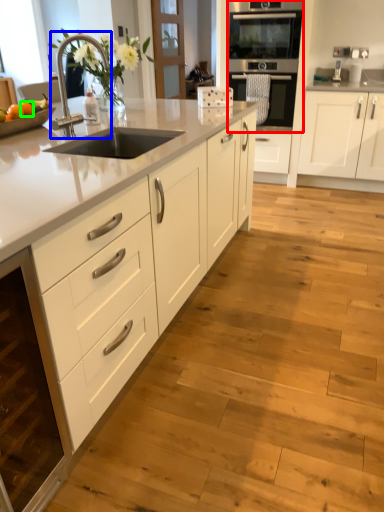
Question: Which object is the closest to the oven (highlighted by a red box)? Choose among these: faucet (highlighted by a blue box) or orange (highlighted by a green box).

Choices:
 (A) faucet
 (B) orange

Answer: (A)